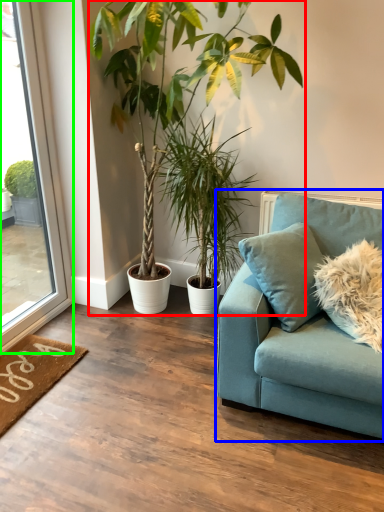
Question: Which is farther away from houseplant (highlighted by a red box)? studio couch (highlighted by a blue box) or window (highlighted by a green box)?

Choices:
 (A) studio couch
 (B) window

Answer: (A)